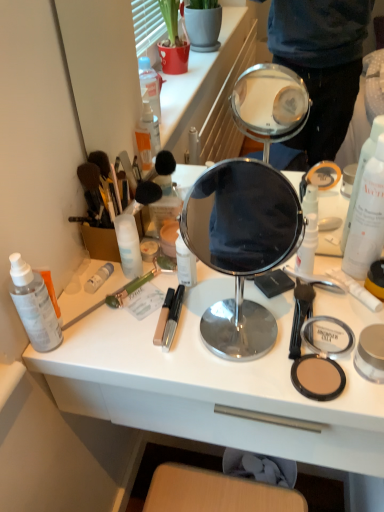
Locate an element on the screen. Image resolution: width=384 pixels, height=512 pixels. empty space that is in between polished silver mirror at center and green plastic brush at lower left is located at coordinates (150, 315).